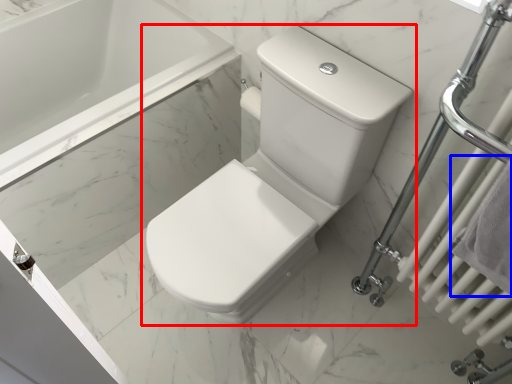
Question: Which object appears farthest to the camera in this image, toilet (highlighted by a red box) or bath towel (highlighted by a blue box)?

Choices:
 (A) toilet
 (B) bath towel

Answer: (A)